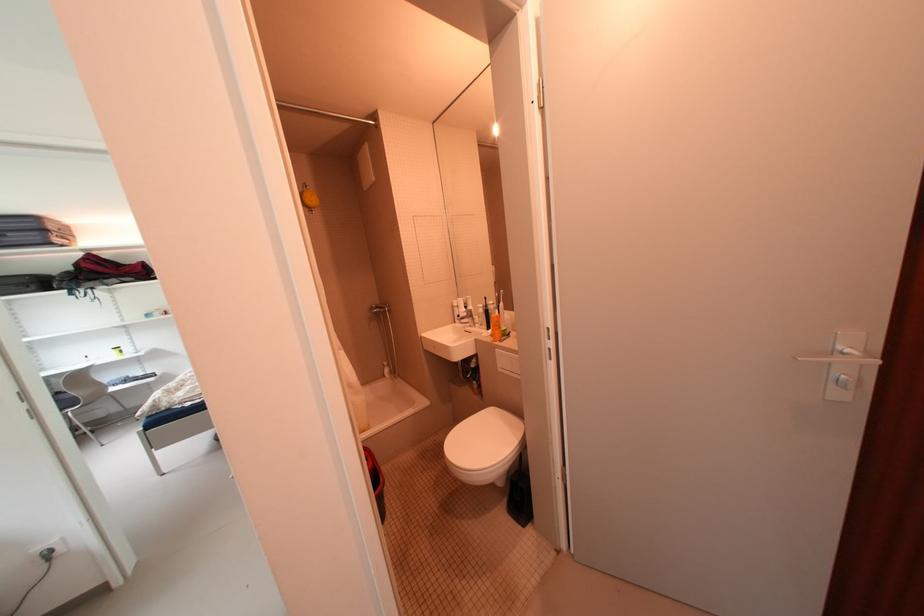
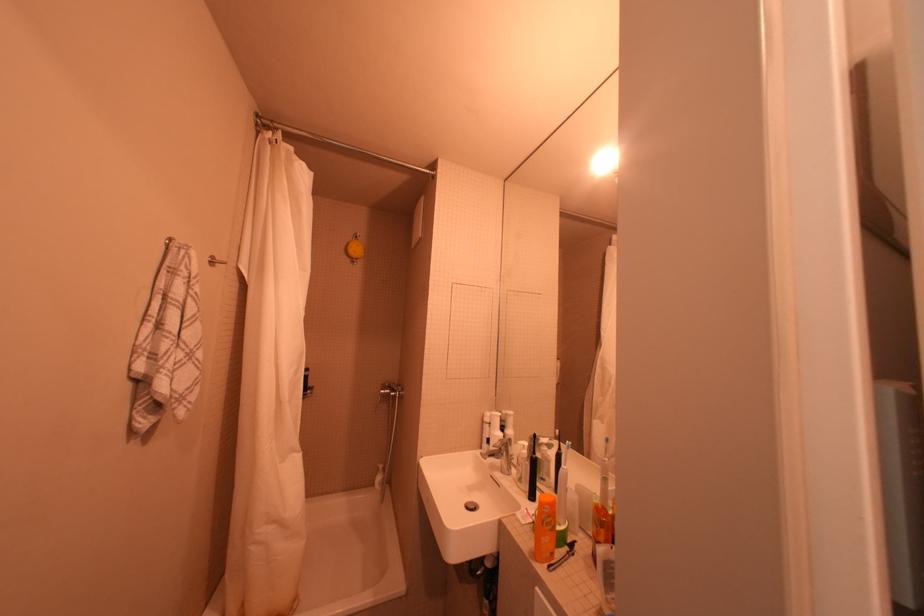
Question: I am providing you with two images of the same scene from different viewpoints. Which of the following objects are not visible in image2?

Choices:
 (A) soap dispenser pump
 (B) bottle pump dispenser
 (C) orange bottle cap
 (D) none of these

Answer: (D)